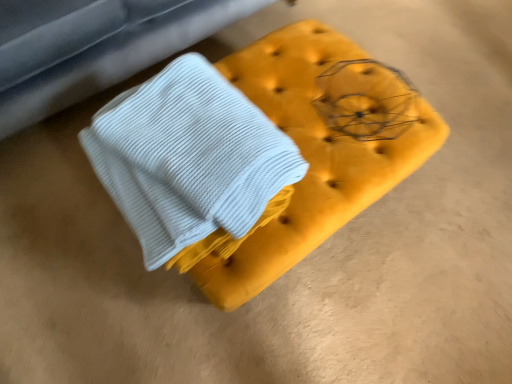
Question: From a real-world perspective, is velvet yellow ottoman at center, the 2th furniture from the top, positioned under white ribbed fabric at center, which is the second furniture in bottom-to-top order, based on gravity?

Choices:
 (A) no
 (B) yes

Answer: (B)

Question: From a real-world perspective, is velvet yellow ottoman at center, the 2th furniture from the top, over white ribbed fabric at center, positioned as the 1th furniture in top-to-bottom order?

Choices:
 (A) yes
 (B) no

Answer: (B)

Question: Is velvet yellow ottoman at center, the 2th furniture from the top, beside white ribbed fabric at center, positioned as the 1th furniture in top-to-bottom order?

Choices:
 (A) no
 (B) yes

Answer: (A)

Question: Can you confirm if velvet yellow ottoman at center, which is the 1th furniture in bottom-to-top order, is positioned to the right of white ribbed fabric at center, which is the second furniture in bottom-to-top order?

Choices:
 (A) yes
 (B) no

Answer: (A)

Question: Is the depth of velvet yellow ottoman at center, the 2th furniture from the top, less than that of white ribbed fabric at center, positioned as the 1th furniture in top-to-bottom order?

Choices:
 (A) yes
 (B) no

Answer: (A)

Question: Considering the relative sizes of velvet yellow ottoman at center, the 2th furniture from the top, and white ribbed fabric at center, which is the second furniture in bottom-to-top order, in the image provided, is velvet yellow ottoman at center, the 2th furniture from the top, taller than white ribbed fabric at center, which is the second furniture in bottom-to-top order,?

Choices:
 (A) yes
 (B) no

Answer: (B)

Question: Considering the relative sizes of white ribbed fabric at center, which is the second furniture in bottom-to-top order, and velvet yellow ottoman at center, the 2th furniture from the top, in the image provided, is white ribbed fabric at center, which is the second furniture in bottom-to-top order, taller than velvet yellow ottoman at center, the 2th furniture from the top,?

Choices:
 (A) yes
 (B) no

Answer: (A)

Question: From a real-world perspective, is white ribbed fabric at center, which is the second furniture in bottom-to-top order, on velvet yellow ottoman at center, the 2th furniture from the top?

Choices:
 (A) no
 (B) yes

Answer: (B)

Question: Is white ribbed fabric at center, which is the second furniture in bottom-to-top order, located outside velvet yellow ottoman at center, the 2th furniture from the top?

Choices:
 (A) yes
 (B) no

Answer: (A)

Question: Is white ribbed fabric at center, which is the second furniture in bottom-to-top order, positioned far away from velvet yellow ottoman at center, the 2th furniture from the top?

Choices:
 (A) yes
 (B) no

Answer: (B)

Question: Is white ribbed fabric at center, positioned as the 1th furniture in top-to-bottom order, to the left of velvet yellow ottoman at center, the 2th furniture from the top, from the viewer's perspective?

Choices:
 (A) no
 (B) yes

Answer: (B)

Question: Considering the relative sizes of white ribbed fabric at center, which is the second furniture in bottom-to-top order, and velvet yellow ottoman at center, the 2th furniture from the top, in the image provided, is white ribbed fabric at center, which is the second furniture in bottom-to-top order, smaller than velvet yellow ottoman at center, the 2th furniture from the top,?

Choices:
 (A) no
 (B) yes

Answer: (A)

Question: In terms of width, does velvet yellow ottoman at center, the 2th furniture from the top, look wider or thinner when compared to white ribbed fabric at center, positioned as the 1th furniture in top-to-bottom order?

Choices:
 (A) wide
 (B) thin

Answer: (B)